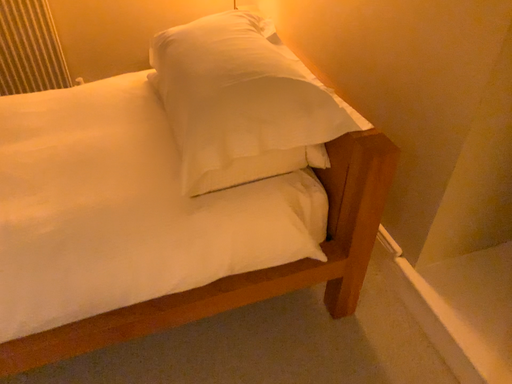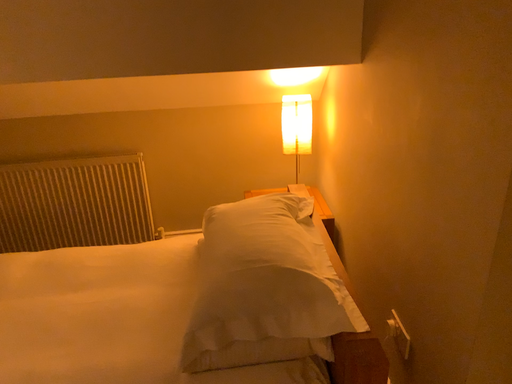
Question: How did the camera likely rotate when shooting the video?

Choices:
 (A) rotated left
 (B) rotated right

Answer: (A)